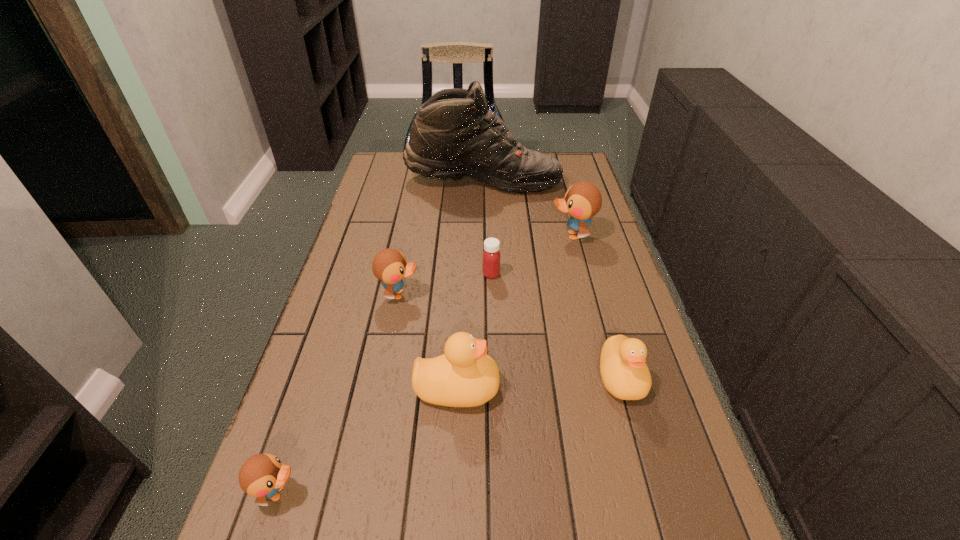
The image size is (960, 540). In order to click on free region at the far right corner of the desktop in this screenshot , I will do `click(579, 166)`.

Find the location of `vacant area between the red medicine and the leftmost blue duck`. vacant area between the red medicine and the leftmost blue duck is located at coordinates (385, 383).

Image resolution: width=960 pixels, height=540 pixels. In order to click on vacant area that lies between the leftmost blue duck and the fourth duck from right to left in this screenshot , I will do `click(339, 394)`.

Locate an element on the screen. The height and width of the screenshot is (540, 960). free area in between the smaller yellow duck and the third duck from left to right is located at coordinates (540, 383).

Find the location of a particular element. The height and width of the screenshot is (540, 960). empty space that is in between the red medicine and the smallest blue duck is located at coordinates coord(385,383).

The width and height of the screenshot is (960, 540). What are the coordinates of `free space between the red medicine and the smaller yellow duck` in the screenshot? It's located at (556, 326).

The width and height of the screenshot is (960, 540). Identify the location of vacant point located between the right yellow duck and the fourth nearest object. (510, 336).

Identify the location of free space between the second biggest blue duck and the left yellow duck. (428, 341).

I want to click on vacant area that lies between the medicine and the second duck from left to right, so click(445, 284).

Image resolution: width=960 pixels, height=540 pixels. Identify the location of vacant area that lies between the left yellow duck and the leftmost duck. (368, 440).